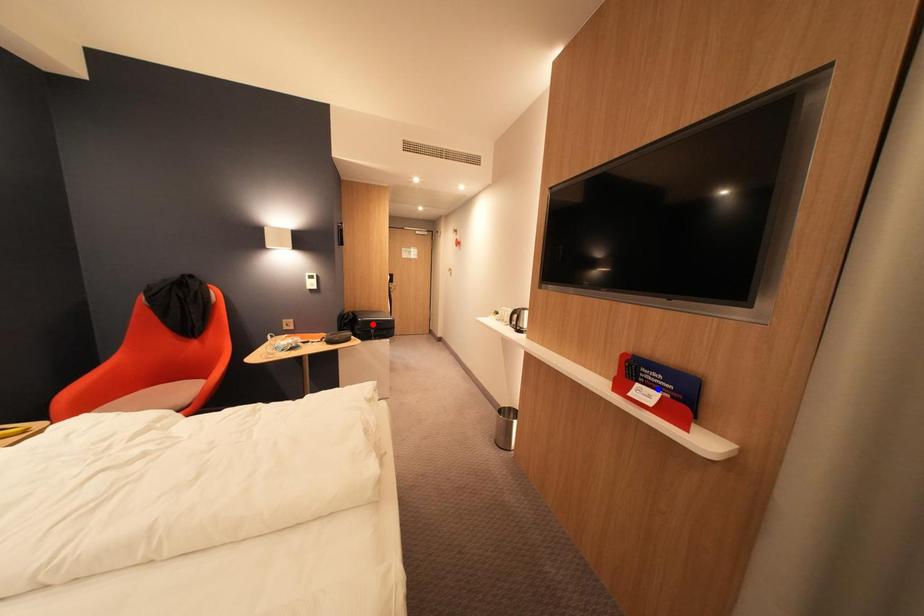
Question: Two points are marked on the image. Which point is closer to the camera?

Choices:
 (A) Blue point is closer.
 (B) Red point is closer.

Answer: (A)